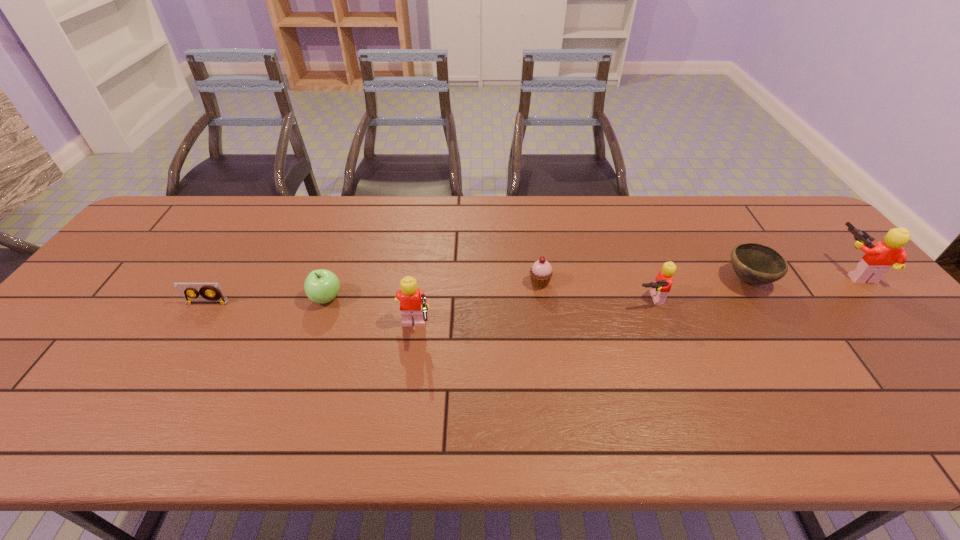
Where is `the leftmost Lego`? the leftmost Lego is located at coordinates (413, 302).

What are the coordinates of `the sixth shortest object` in the screenshot? It's located at (413, 302).

What are the coordinates of `the second Lego from left to right` in the screenshot? It's located at (664, 280).

Identify the location of the shortest Lego. [664, 280].

Locate an element on the screen. Image resolution: width=960 pixels, height=540 pixels. the farthest Lego is located at coordinates (878, 259).

Identify the location of the rightmost object. (878, 259).

Identify the location of the second object from left to right. (321, 286).

This screenshot has height=540, width=960. Identify the location of the fourth object from right to left. (541, 272).

The height and width of the screenshot is (540, 960). Identify the location of bowl. (756, 264).

Image resolution: width=960 pixels, height=540 pixels. Identify the location of the shortest object. (209, 292).